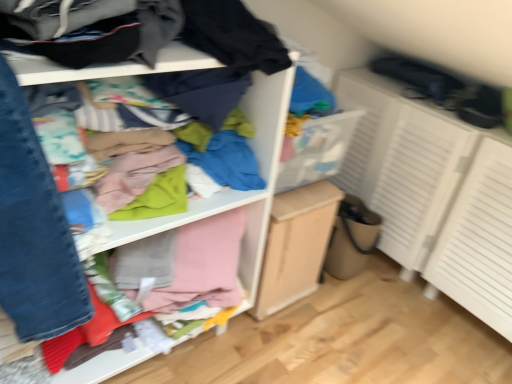
Question: From a real-world perspective, is light wood/file cabinet at center above or below white textured cabinet at right?

Choices:
 (A) below
 (B) above

Answer: (A)

Question: Considering the relative positions of light wood/file cabinet at center and white textured cabinet at right in the image provided, is light wood/file cabinet at center to the left or to the right of white textured cabinet at right?

Choices:
 (A) left
 (B) right

Answer: (A)

Question: Which object is the farthest from the cloth at upper left?

Choices:
 (A) white textured cabinet at right
 (B) light wood/file cabinet at center

Answer: (A)

Question: Which is farther from the light wood/file cabinet at center?

Choices:
 (A) white textured cabinet at right
 (B) cloth at upper left

Answer: (A)